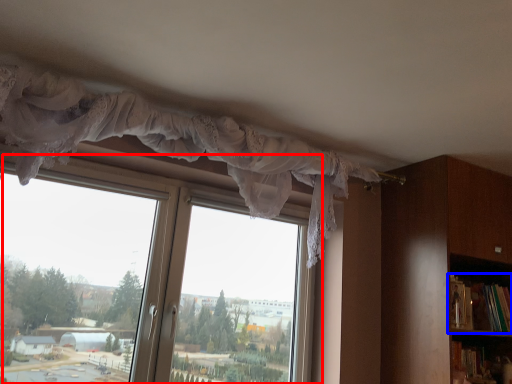
Question: Among these objects, which one is nearest to the camera, window (highlighted by a red box) or book (highlighted by a blue box)?

Choices:
 (A) window
 (B) book

Answer: (A)